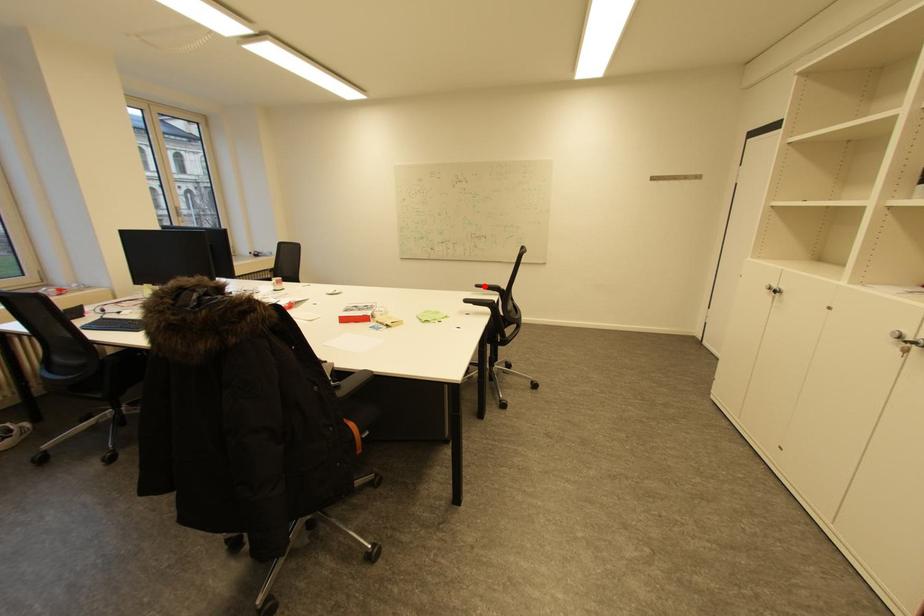
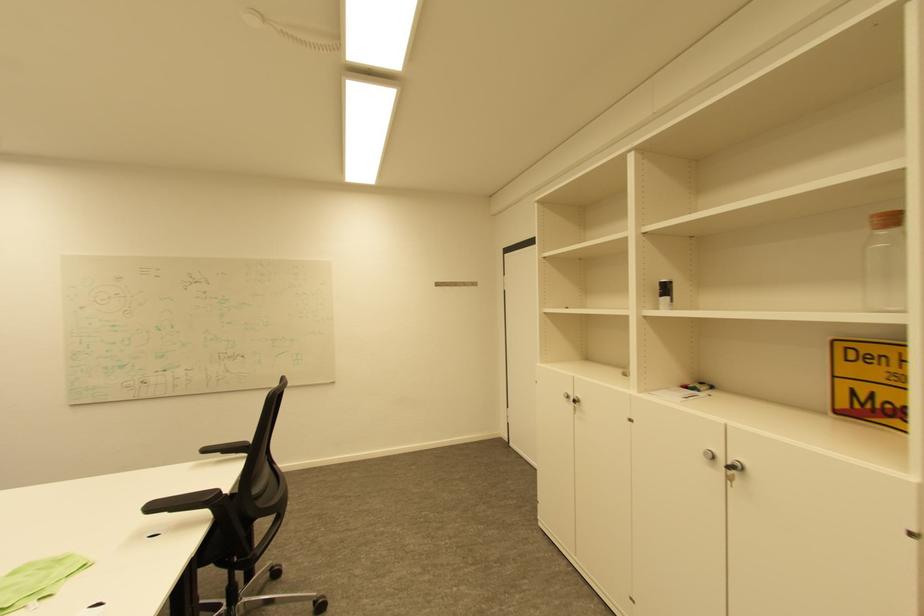
The point at the highlighted location is marked in the first image. Where is the corresponding point in the second image?

(213, 450)